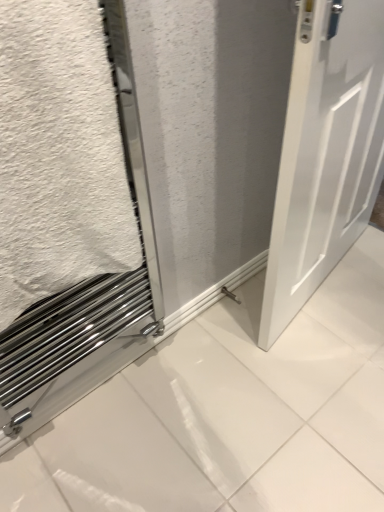
Where is `vacant area that is in front of white matte door at right`? This screenshot has height=512, width=384. vacant area that is in front of white matte door at right is located at coordinates (318, 379).